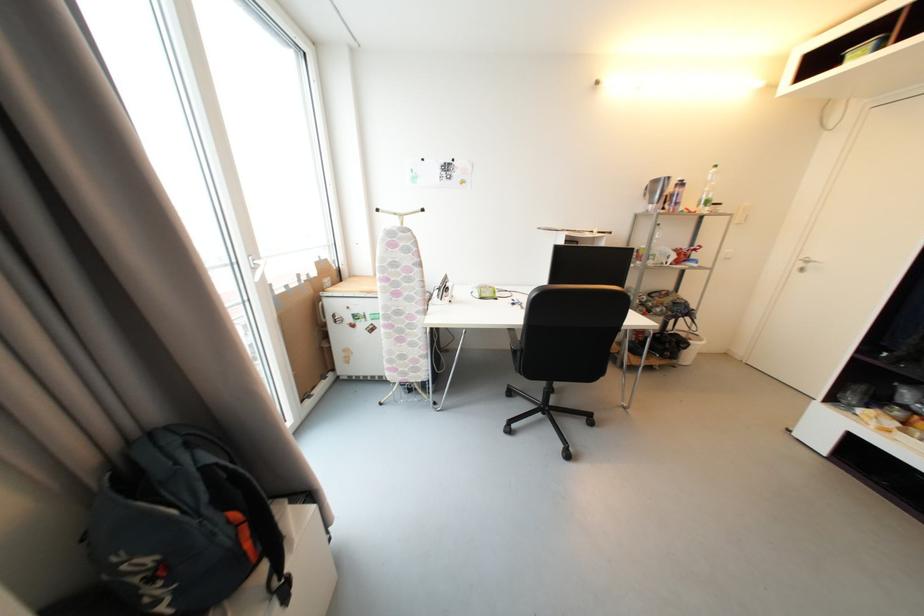
Locate an element on the screen. This screenshot has height=616, width=924. chair sitting surface is located at coordinates (514, 342).